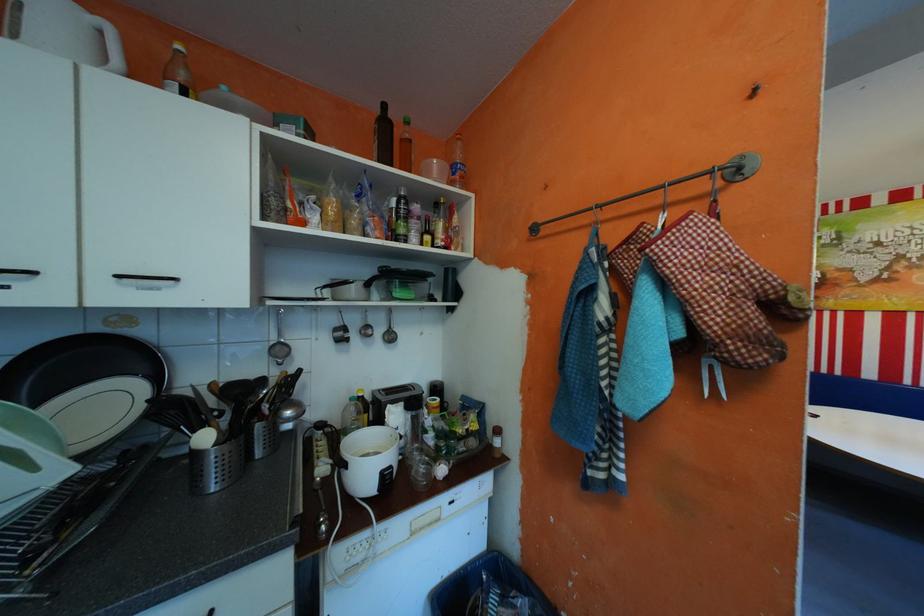
Image resolution: width=924 pixels, height=616 pixels. What do you see at coordinates (711, 376) in the screenshot?
I see `the white handle scissors` at bounding box center [711, 376].